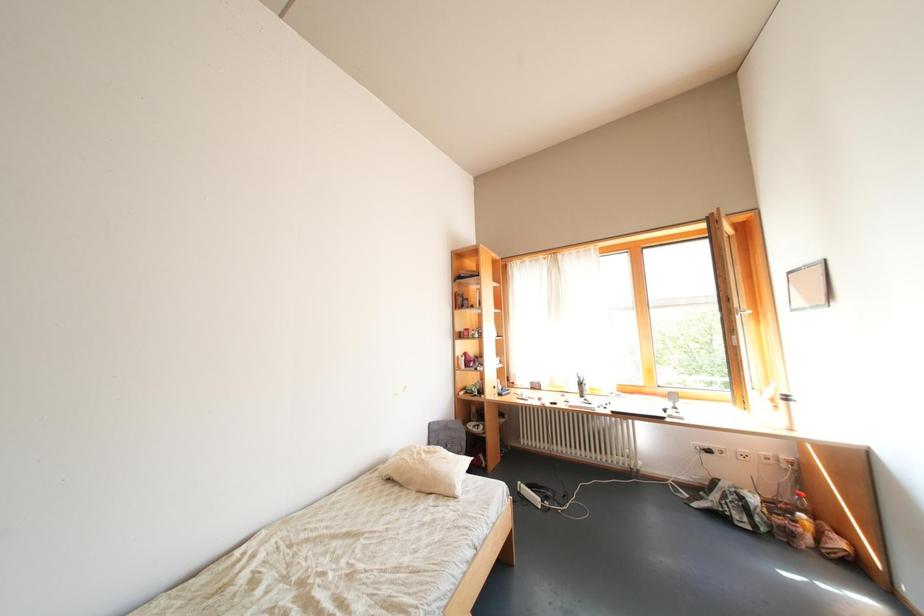
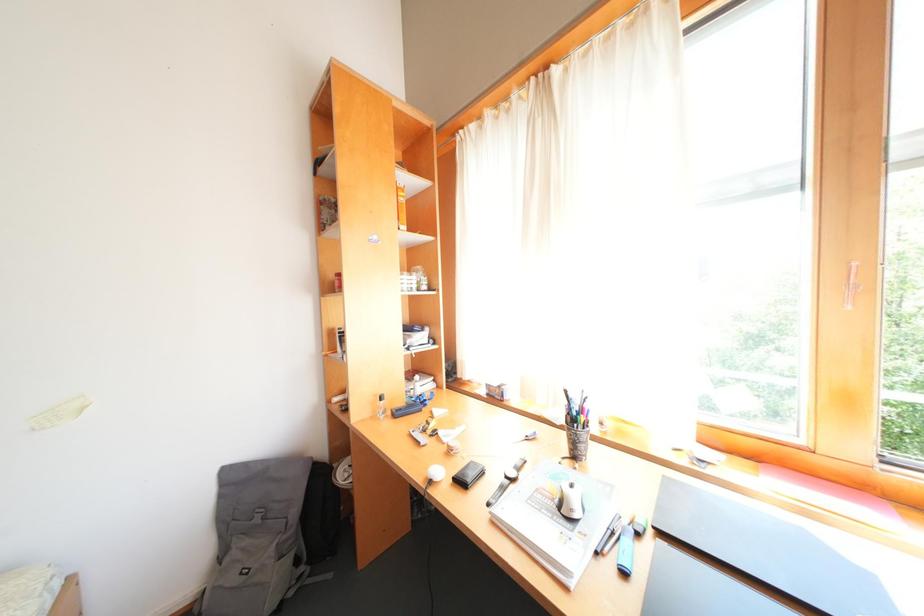
Which direction would the cameraman need to move to produce the second image?

The cameraman walked toward right, forward.